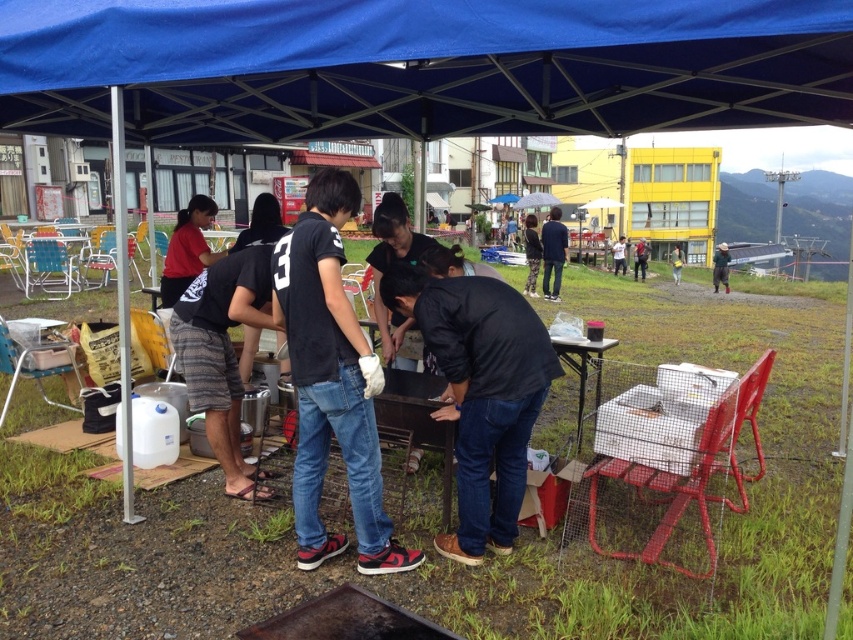
You are planning to set up a small booth under the blue fabric canopy at upper center for a community event. The booth requires a table that is placed in front of the canopy so it can be easily seen from the entrance. Is the metallic silver table at center positioned correctly for this purpose?

The metallic silver table at center is behind the blue fabric canopy at upper center, so it would not be visible from the entrance if placed there. To be seen easily, the table should be placed in front of the canopy instead.

From the picture: You are standing at the entrance of the blue canopy tent and want to place a new rectangular table that is 1.5 meters long. The metallic silver table at center is already occupying space. Based on its coordinates, is there enough space to place the new table without overlapping?

The metallic silver table at center is located at coordinates point (583, 368). Without specific spatial dimensions or orientation of the existing table, it is impossible to determine if there is enough space to place the new table without overlapping.

You are at a picnic and want to place a large platter on the metallic silver table at center. However, you notice the blue fabric canopy at upper center might block sunlight. Which direction should you move the table to avoid the shade?

The blue fabric canopy at upper center is to the left of the metallic silver table at center. To avoid the shade, move the table to the right side away from the canopy.